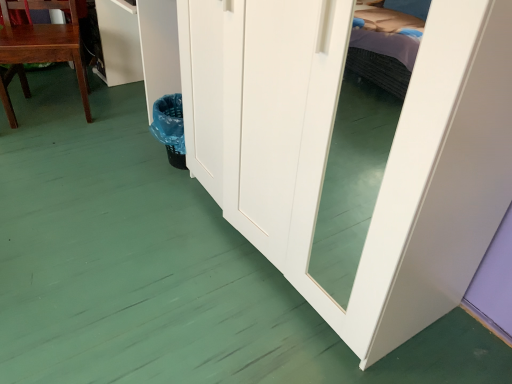
Locate an element on the screen. white glossy cabinet at upper left is located at coordinates (118, 43).

What do you see at coordinates (118, 43) in the screenshot? The width and height of the screenshot is (512, 384). I see `white glossy cabinet at upper left` at bounding box center [118, 43].

What do you see at coordinates (40, 49) in the screenshot? I see `matte wood chair at left` at bounding box center [40, 49].

Identify the location of matte wood chair at left. The image size is (512, 384). (40, 49).

What are the coordinates of `white glossy cabinet at upper left` in the screenshot? It's located at (118, 43).

Which object is positioned more to the left, white glossy cabinet at upper left or matte wood chair at left?

From the viewer's perspective, matte wood chair at left appears more on the left side.

Relative to matte wood chair at left, is white glossy cabinet at upper left in front or behind?

Clearly, white glossy cabinet at upper left is behind matte wood chair at left.

Is point (138, 41) behind point (79, 52)?

Yes, point (138, 41) is behind point (79, 52).

From the image's perspective, is white glossy cabinet at upper left over matte wood chair at left?

Yes, from the image's perspective, white glossy cabinet at upper left is over matte wood chair at left.

From a real-world perspective, is white glossy cabinet at upper left above or below matte wood chair at left?

white glossy cabinet at upper left is situated lower than matte wood chair at left in the real world.

Can you confirm if white glossy cabinet at upper left is thinner than matte wood chair at left?

Indeed, white glossy cabinet at upper left has a lesser width compared to matte wood chair at left.

Considering the sizes of objects white glossy cabinet at upper left and matte wood chair at left in the image provided, who is taller, white glossy cabinet at upper left or matte wood chair at left?

matte wood chair at left.

Considering the relative sizes of white glossy cabinet at upper left and matte wood chair at left in the image provided, is white glossy cabinet at upper left bigger than matte wood chair at left?

Actually, white glossy cabinet at upper left might be smaller than matte wood chair at left.

Can we say white glossy cabinet at upper left lies outside matte wood chair at left?

Yes, white glossy cabinet at upper left is located beyond the bounds of matte wood chair at left.

From the picture: Would you consider white glossy cabinet at upper left to be distant from matte wood chair at left?

No, white glossy cabinet at upper left is not far from matte wood chair at left.

Is white glossy cabinet at upper left positioned with its back to matte wood chair at left?

No, white glossy cabinet at upper left is not facing the opposite direction of matte wood chair at left.

In the scene shown: Measure the distance from white glossy cabinet at upper left to matte wood chair at left.

white glossy cabinet at upper left is 14.62 inches away from matte wood chair at left.

At what (x,y) coordinates should I click in order to perform the action: click on cabinetry located on the right of matte wood chair at left. Please return your answer as a coordinate pair (x, y). Image resolution: width=512 pixels, height=384 pixels. Looking at the image, I should click on (118, 43).

From the picture: Would you say matte wood chair at left is to the left or to the right of white glossy cabinet at upper left in the picture?

Based on their positions, matte wood chair at left is located to the left of white glossy cabinet at upper left.

Looking at this image, considering their positions, is matte wood chair at left located in front of or behind white glossy cabinet at upper left?

In the image, matte wood chair at left appears in front of white glossy cabinet at upper left.

Is point (5, 110) less distant than point (134, 7)?

Yes, it is in front of point (134, 7).

From the image's perspective, is matte wood chair at left located beneath white glossy cabinet at upper left?

Yes, from the image's perspective, matte wood chair at left is beneath white glossy cabinet at upper left.

From a real-world perspective, is matte wood chair at left on white glossy cabinet at upper left?

Correct, in the physical world, matte wood chair at left is higher than white glossy cabinet at upper left.

Considering the sizes of objects matte wood chair at left and white glossy cabinet at upper left in the image provided, who is thinner, matte wood chair at left or white glossy cabinet at upper left?

Thinner between the two is white glossy cabinet at upper left.

Consider the image. Which of these two, matte wood chair at left or white glossy cabinet at upper left, stands taller?

Standing taller between the two is matte wood chair at left.

Which of these two, matte wood chair at left or white glossy cabinet at upper left, is bigger?

matte wood chair at left is bigger.

Is matte wood chair at left not within white glossy cabinet at upper left?

matte wood chair at left lies outside white glossy cabinet at upper left's area.

Does matte wood chair at left touch white glossy cabinet at upper left?

matte wood chair at left and white glossy cabinet at upper left are not in contact.

Is matte wood chair at left oriented towards white glossy cabinet at upper left?

No.

Find the location of a particular element. Image resolution: width=512 pixels, height=384 pixels. chair located in front of the white glossy cabinet at upper left is located at coordinates (40, 49).

I want to click on cabinetry above the matte wood chair at left (from the image's perspective), so click(118, 43).

I want to click on chair located in front of the white glossy cabinet at upper left, so click(40, 49).